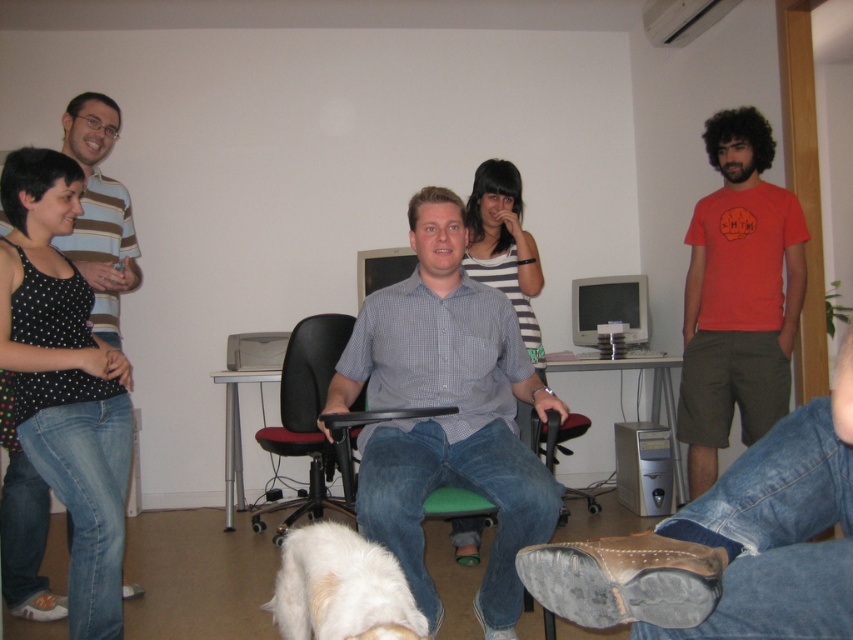
You are a guest at this gathering and want to pet the dog. Which object is closer to the entrance if you are facing the scene? Please choose between the white fluffy dog at lower center and the striped fabric dress at center.

The white fluffy dog at lower center is to the left of the striped fabric dress at center, so if you are facing the scene, the white fluffy dog at lower center would be closer to the entrance on the left side.

You are standing at the point labeled as point (451, 536) and want to walk towards the point labeled as point (708, 276). In which direction should you move relative to your current position?

You should move forward because point (708, 276) is in front of point (451, 536).